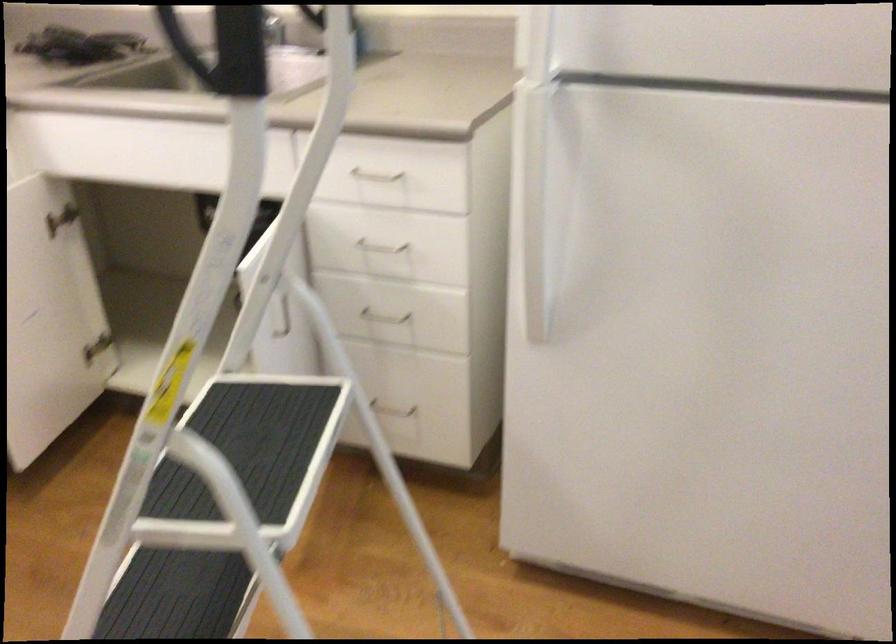
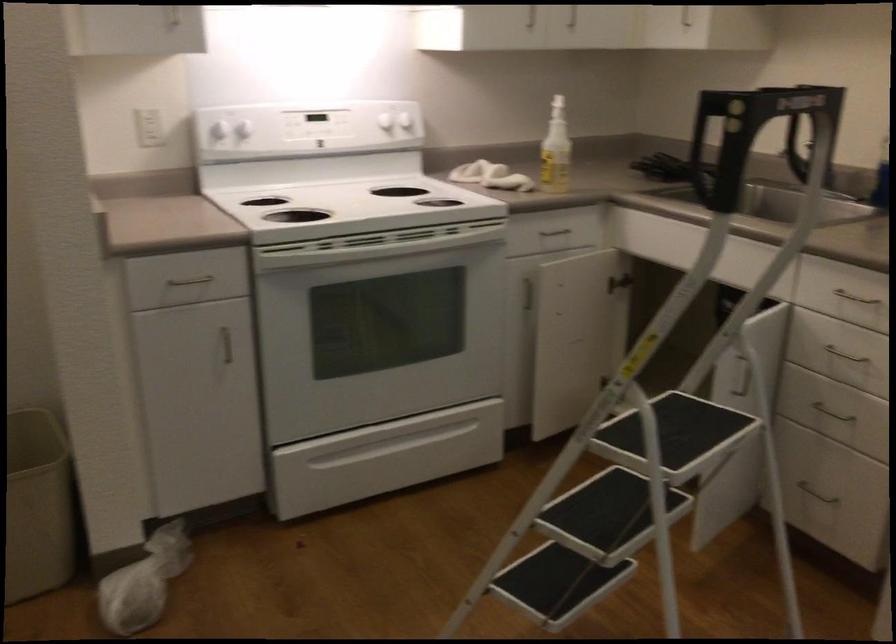
Question: The camera is either moving clockwise (left) or counter-clockwise (right) around the object. The first image is from the beginning of the video and the second image is from the end. Is the camera moving left or right when shooting the video?

Choices:
 (A) Left
 (B) Right

Answer: (B)